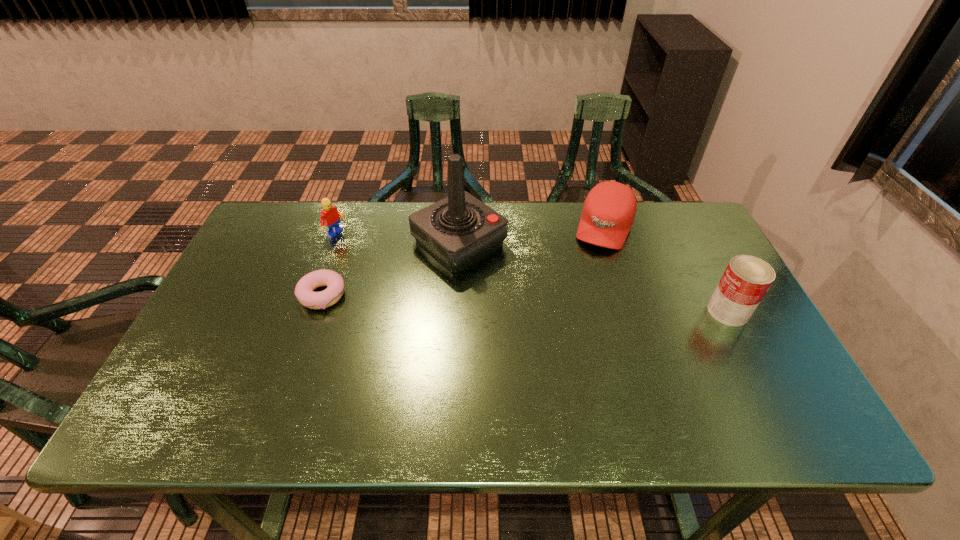
Image resolution: width=960 pixels, height=540 pixels. Identify the location of the shortest object. (307, 284).

I want to click on the rightmost object, so click(746, 280).

Find the location of a particular element. the fourth shortest object is located at coordinates (746, 280).

At what (x,y) coordinates should I click in order to perform the action: click on the fourth object from left to right. Please return your answer as a coordinate pair (x, y). Looking at the image, I should click on (608, 213).

Locate an element on the screen. This screenshot has width=960, height=540. the third object from left to right is located at coordinates (458, 230).

You are a GUI agent. You are given a task and a screenshot of the screen. Output one action in this format:
    pyautogui.click(x=<x>, y=<y>)
    Task: Click on the joystick
    
    Given the screenshot: What is the action you would take?
    pyautogui.click(x=458, y=230)

Locate an element on the screen. Lego is located at coordinates (330, 217).

Where is `vacant space located 0.320m on the back of the shortest object`? The width and height of the screenshot is (960, 540). vacant space located 0.320m on the back of the shortest object is located at coordinates click(x=351, y=211).

You are a GUI agent. You are given a task and a screenshot of the screen. Output one action in this format:
    pyautogui.click(x=<x>, y=<y>)
    Task: Click on the vacant space located on the front-facing side of the cap
    
    Given the screenshot: What is the action you would take?
    pyautogui.click(x=564, y=343)

Locate an element on the screen. This screenshot has width=960, height=540. vacant region located on the front-facing side of the cap is located at coordinates click(x=583, y=294).